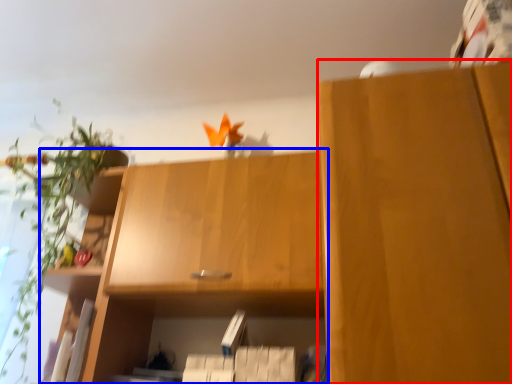
Question: Which object is closer to the camera taking this photo, cabinetry (highlighted by a red box) or cabinetry (highlighted by a blue box)?

Choices:
 (A) cabinetry
 (B) cabinetry

Answer: (A)